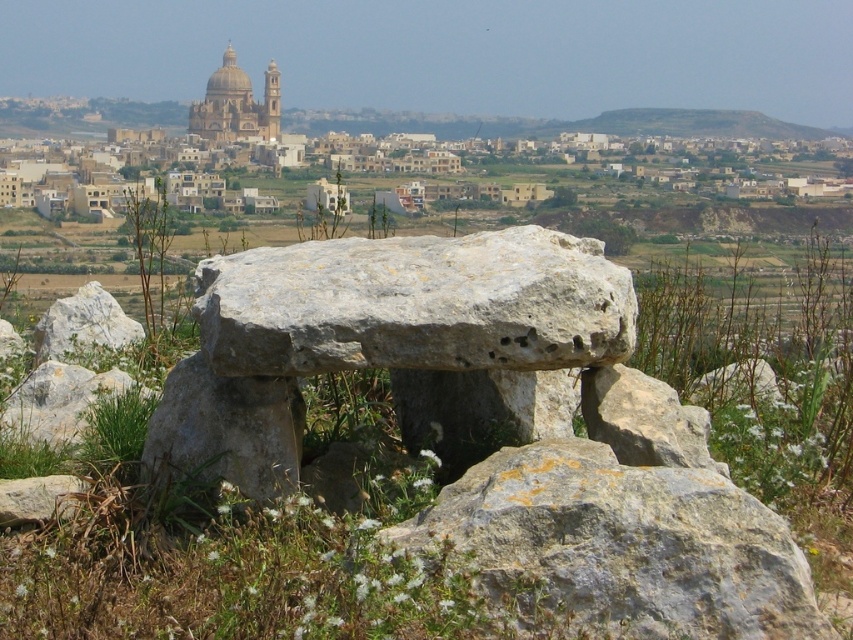
You are an archaeologist examining the ancient stone structures. You notice the gray rough stone at center and the golden stone dome at upper center. Which of these two objects is narrower in width?

The gray rough stone at center has a lesser width compared to the golden stone dome at upper center, so the gray rough stone at center is narrower in width.

Looking at this image, you are an archaeologist examining the ancient stone structures. You notice the gray rough stone at center and the golden stone dome at upper center. Which of these two objects is taller?

The golden stone dome at upper center is taller than the gray rough stone at center.